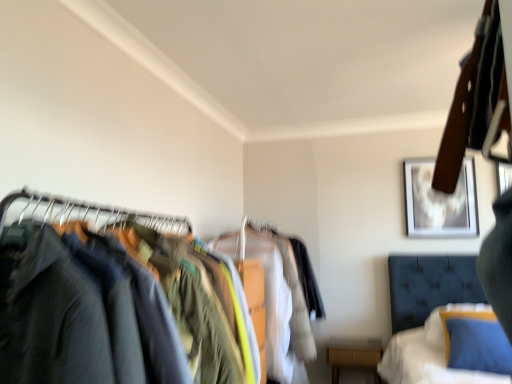
Question: Does wooden framed artwork at upper right, which ranks as the 2th picture frame in right-to-left order, come behind dark blue fabric at left?

Choices:
 (A) yes
 (B) no

Answer: (A)

Question: Can you confirm if wooden framed artwork at upper right, which ranks as the 2th picture frame in right-to-left order, is shorter than dark blue fabric at left?

Choices:
 (A) no
 (B) yes

Answer: (B)

Question: Is the depth of wooden framed artwork at upper right, marked as the 1th picture frame in a left-to-right arrangement, less than that of dark blue fabric at left?

Choices:
 (A) no
 (B) yes

Answer: (A)

Question: Is wooden framed artwork at upper right, marked as the 1th picture frame in a left-to-right arrangement, next to dark blue fabric at left and touching it?

Choices:
 (A) no
 (B) yes

Answer: (A)

Question: Is wooden framed artwork at upper right, marked as the 1th picture frame in a left-to-right arrangement, outside dark blue fabric at left?

Choices:
 (A) no
 (B) yes

Answer: (B)

Question: From a real-world perspective, relative to white cotton shirt at center, the first clothing when ordered from back to front, is metallic silver picture frame at upper right, positioned as the 2th picture frame in left-to-right order, vertically above or below?

Choices:
 (A) below
 (B) above

Answer: (B)

Question: In terms of size, does metallic silver picture frame at upper right, positioned as the 2th picture frame in left-to-right order, appear bigger or smaller than white cotton shirt at center, the first clothing when ordered from back to front?

Choices:
 (A) small
 (B) big

Answer: (A)

Question: In terms of height, does metallic silver picture frame at upper right, the first picture frame viewed from the right, look taller or shorter compared to white cotton shirt at center, the first clothing when ordered from back to front?

Choices:
 (A) short
 (B) tall

Answer: (A)

Question: Considering the positions of point (499, 188) and point (279, 332), is point (499, 188) closer or farther from the camera than point (279, 332)?

Choices:
 (A) farther
 (B) closer

Answer: (B)

Question: From a real-world perspective, is metallic silver picture frame at upper right, the first picture frame viewed from the right, physically located above or below dark blue fabric at left?

Choices:
 (A) below
 (B) above

Answer: (B)

Question: Is metallic silver picture frame at upper right, the first picture frame viewed from the right, taller or shorter than dark blue fabric at left?

Choices:
 (A) tall
 (B) short

Answer: (B)

Question: Is metallic silver picture frame at upper right, the first picture frame viewed from the right, in front of or behind dark blue fabric at left in the image?

Choices:
 (A) behind
 (B) front

Answer: (A)

Question: Considering the positions of metallic silver picture frame at upper right, the first picture frame viewed from the right, and dark blue fabric at left in the image, is metallic silver picture frame at upper right, the first picture frame viewed from the right, bigger or smaller than dark blue fabric at left?

Choices:
 (A) small
 (B) big

Answer: (A)

Question: From the image's perspective, is velvet blue bed at lower right positioned above or below white cotton shirt at center, acting as the 2th clothing starting from the front?

Choices:
 (A) below
 (B) above

Answer: (A)

Question: Considering the positions of velvet blue bed at lower right and white cotton shirt at center, the first clothing when ordered from back to front, in the image, is velvet blue bed at lower right taller or shorter than white cotton shirt at center, the first clothing when ordered from back to front,?

Choices:
 (A) tall
 (B) short

Answer: (B)